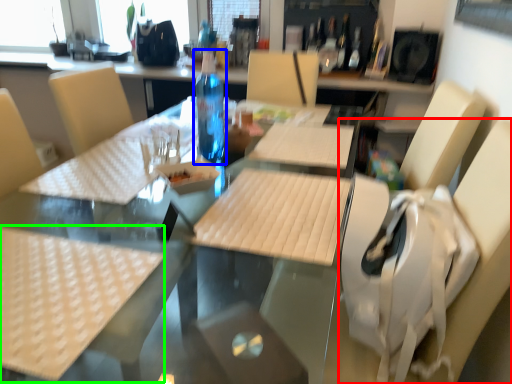
Question: Based on their relative distances, which object is nearer to swivel chair (highlighted by a red box)? Choose from bottle (highlighted by a blue box) and tablecloth (highlighted by a green box).

Choices:
 (A) bottle
 (B) tablecloth

Answer: (B)